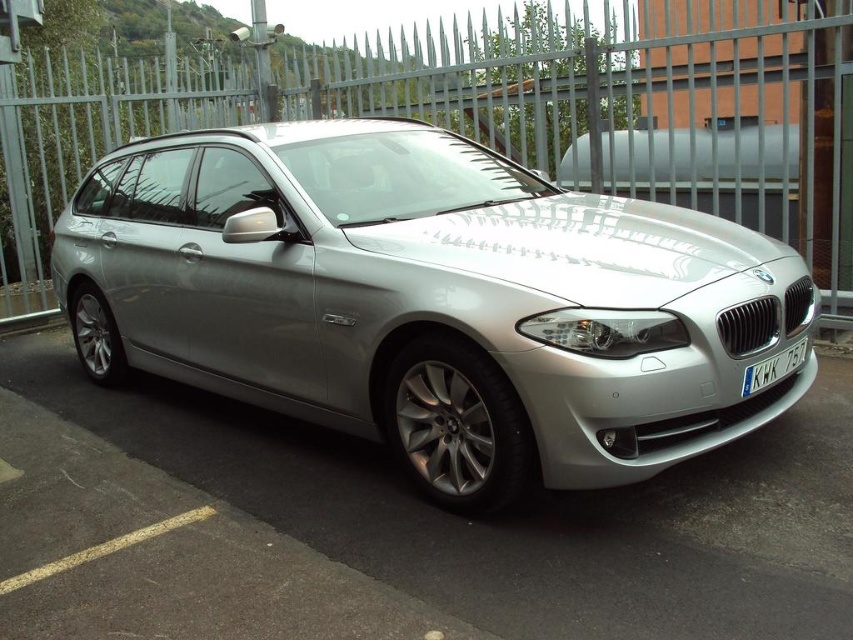
Question: Which point is closer to the camera taking this photo?

Choices:
 (A) (753, 371)
 (B) (341, 260)

Answer: (A)

Question: Is the position of satin silver car at center less distant than that of silver metallic car at center?

Choices:
 (A) yes
 (B) no

Answer: (B)

Question: Is silver metallic car at center further to camera compared to white plastic license plate at front?

Choices:
 (A) yes
 (B) no

Answer: (B)

Question: Which point appears closest to the camera in this image?

Choices:
 (A) (775, 218)
 (B) (9, 509)

Answer: (B)

Question: Considering the relative positions of satin silver car at center and metallic gray fence at center in the image provided, where is satin silver car at center located with respect to metallic gray fence at center?

Choices:
 (A) right
 (B) left

Answer: (B)

Question: Which of the following is the farthest from the observer?

Choices:
 (A) satin silver car at center
 (B) silver metallic car at center

Answer: (A)